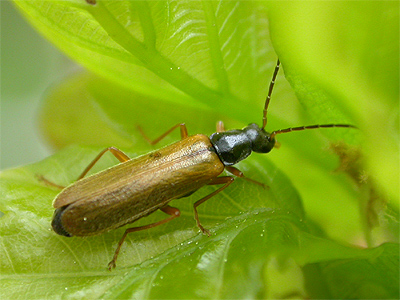
Identify the location of left front leg. This screenshot has height=300, width=400. (184, 134).